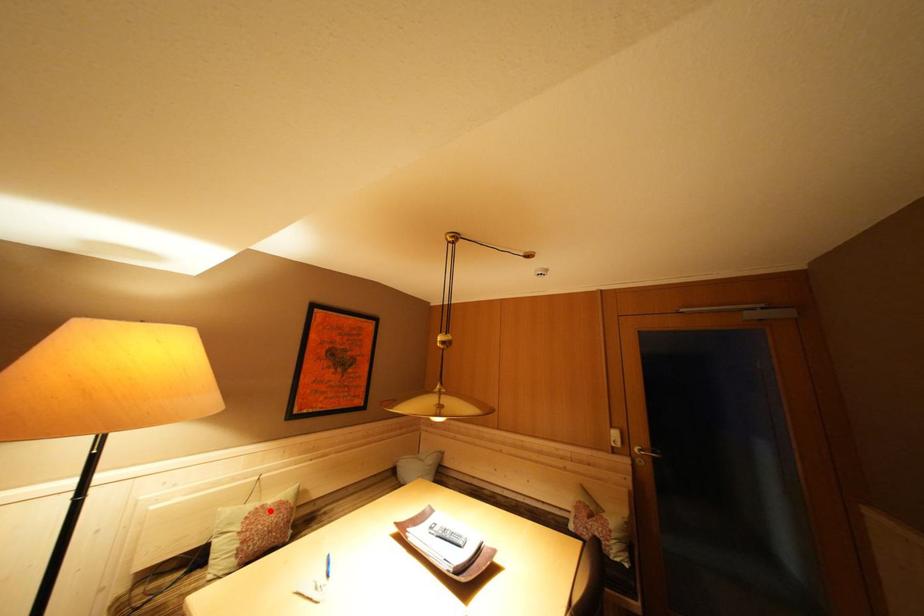
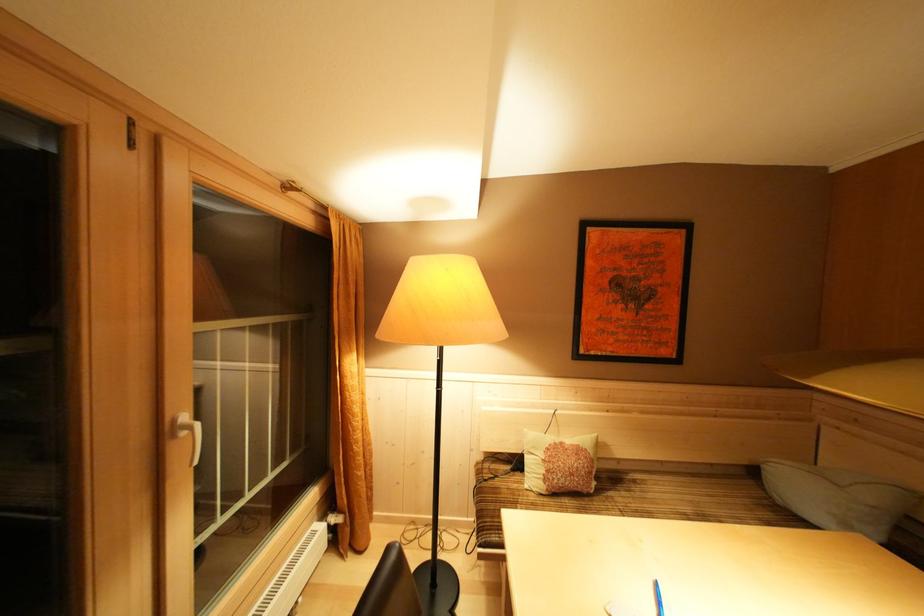
Question: I am providing you with two images of the same scene from different viewpoints. A red point is shown in image1. For the corresponding object point in image2, is it positioned nearer or farther from the camera?

Choices:
 (A) Nearer
 (B) Farther

Answer: (B)